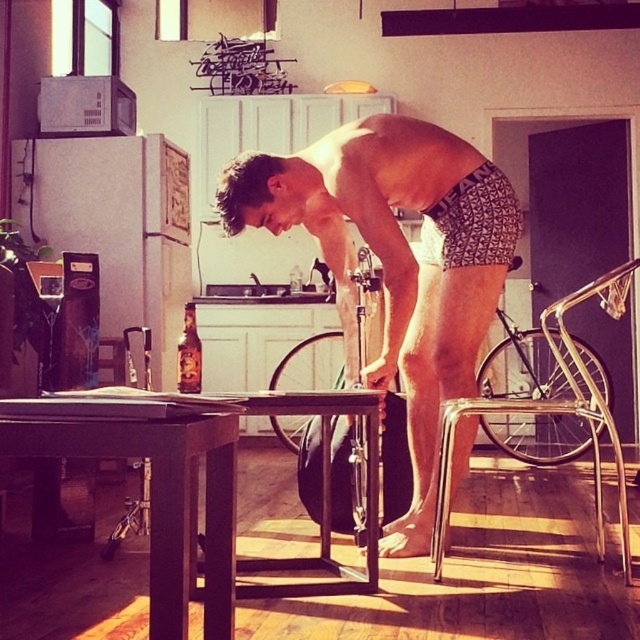
Between dark wood table at center and translucent glass bottle at center, which one has less height?

With less height is translucent glass bottle at center.

Is dark wood table at center shorter than translucent glass bottle at center?

Incorrect, dark wood table at center's height does not fall short of translucent glass bottle at center's.

Is point (230, 570) less distant than point (179, 371)?

Yes, point (230, 570) is in front of point (179, 371).

Identify the location of dark wood table at center. (152, 492).

Is patterned fabric shorts at center thinner than dark wood table at center?

Incorrect, patterned fabric shorts at center's width is not less than dark wood table at center's.

Looking at this image, can you confirm if patterned fabric shorts at center is positioned to the left of dark wood table at center?

No, patterned fabric shorts at center is not to the left of dark wood table at center.

Image resolution: width=640 pixels, height=640 pixels. What do you see at coordinates (396, 260) in the screenshot?
I see `patterned fabric shorts at center` at bounding box center [396, 260].

Image resolution: width=640 pixels, height=640 pixels. What are the coordinates of `patterned fabric shorts at center` in the screenshot? It's located at (396, 260).

Can you confirm if metallic silver chair at lower right is positioned above translucent glass bottle at center?

Incorrect, metallic silver chair at lower right is not positioned above translucent glass bottle at center.

Does metallic silver chair at lower right have a larger size compared to translucent glass bottle at center?

Indeed, metallic silver chair at lower right has a larger size compared to translucent glass bottle at center.

At what (x,y) coordinates should I click in order to perform the action: click on metallic silver chair at lower right. Please return your answer as a coordinate pair (x, y). Looking at the image, I should click on (552, 412).

Find the location of `metallic silver chair at lower right`. metallic silver chair at lower right is located at coordinates (552, 412).